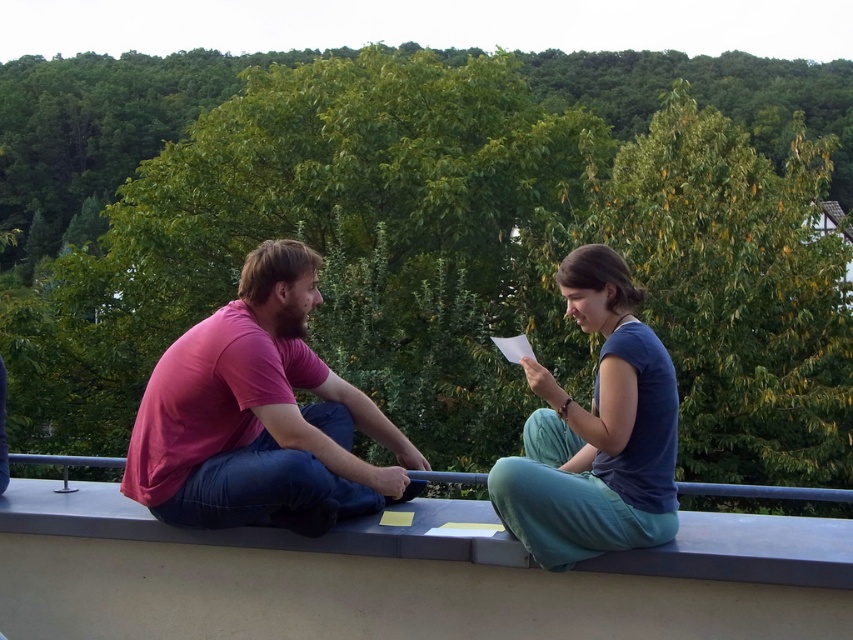
Question: Can you confirm if smooth concrete ledge at center is smaller than pink cotton shirt at left?

Choices:
 (A) no
 (B) yes

Answer: (A)

Question: Which object is the closest to the pink cotton shirt at center?

Choices:
 (A) pink cotton shirt at left
 (B) smooth concrete ledge at center

Answer: (A)

Question: Does pink cotton shirt at center appear on the left side of blue cotton shirt at center?

Choices:
 (A) no
 (B) yes

Answer: (B)

Question: Does pink cotton shirt at left have a smaller size compared to blue cotton shirt at center?

Choices:
 (A) no
 (B) yes

Answer: (A)

Question: Estimate the real-world distances between objects in this image. Which object is closer to the pink cotton shirt at left?

Choices:
 (A) blue cotton shirt at center
 (B) pink cotton shirt at center
 (C) smooth concrete ledge at center

Answer: (B)

Question: Which object is closer to the camera taking this photo?

Choices:
 (A) pink cotton shirt at left
 (B) pink cotton shirt at center
 (C) blue cotton shirt at center
 (D) smooth concrete ledge at center

Answer: (D)